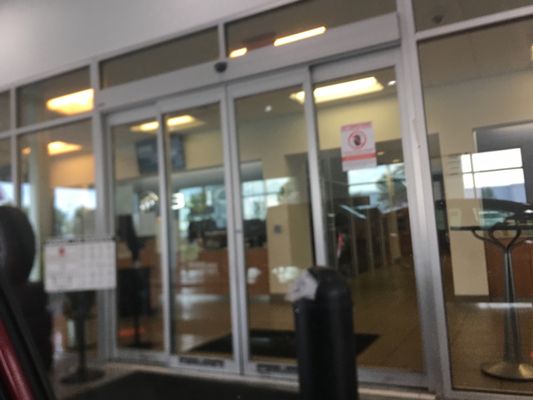
Find the location of `tile floor`. tile floor is located at coordinates (392, 340).